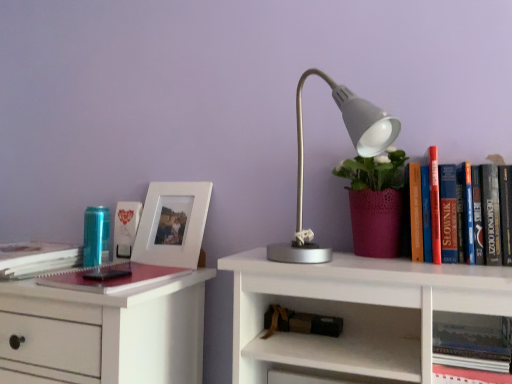
Question: Does point (41, 248) appear closer or farther from the camera than point (138, 263)?

Choices:
 (A) closer
 (B) farther

Answer: (A)

Question: From the image's perspective, relative to matte red notebook at left, which appears as the 3th book when viewed from the left, is hardcover book at left, the fifth book positioned from the right, above or below?

Choices:
 (A) below
 (B) above

Answer: (B)

Question: Based on their relative distances, which object is nearer to the brown leather book at lower center, which ranks as the 4th book in left-to-right order?

Choices:
 (A) matte white photo frame at left, marked as the 5th book in a bottom-to-top arrangement
 (B) matte gray lamp at center
 (C) hardcover book at upper right, which is counted as the first book, starting from the right
 (D) matte red notebook at left, which is the 3th book in bottom-to-top order
 (E) white matte picture frame at left

Answer: (C)

Question: Which is nearer to the matte red notebook at left, which is the 3th book in bottom-to-top order?

Choices:
 (A) hardcover book at upper right, the fifth book when ordered from left to right
 (B) matte gray lamp at center
 (C) hardcover book at left, the fifth book positioned from the right
 (D) brown leather book at lower center, which ranks as the 4th book in left-to-right order
 (E) matte white photo frame at left, marked as the 5th book in a bottom-to-top arrangement

Answer: (C)